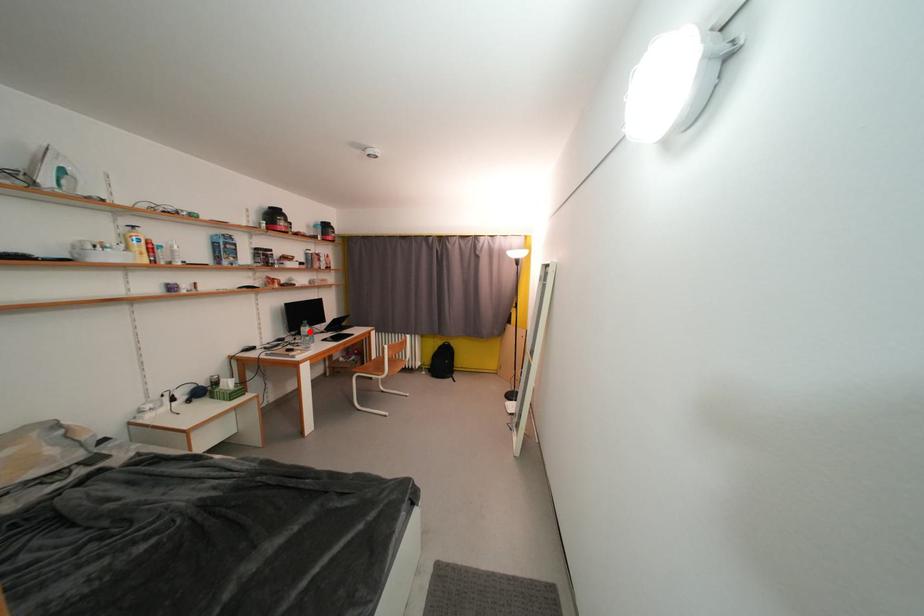
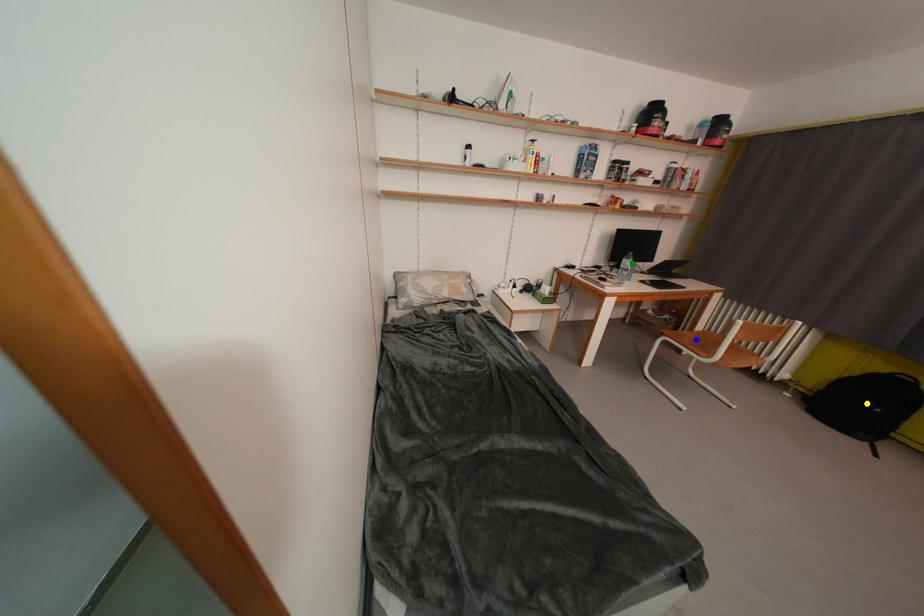
Question: I am providing you with two images of the same scene from different viewpoints. A red point is marked on the first image. You are given multiple points on the second image. Can you choose the point in image 2 that corresponds to the point in image 1?

Choices:
 (A) green point
 (B) yellow point
 (C) blue point

Answer: (A)